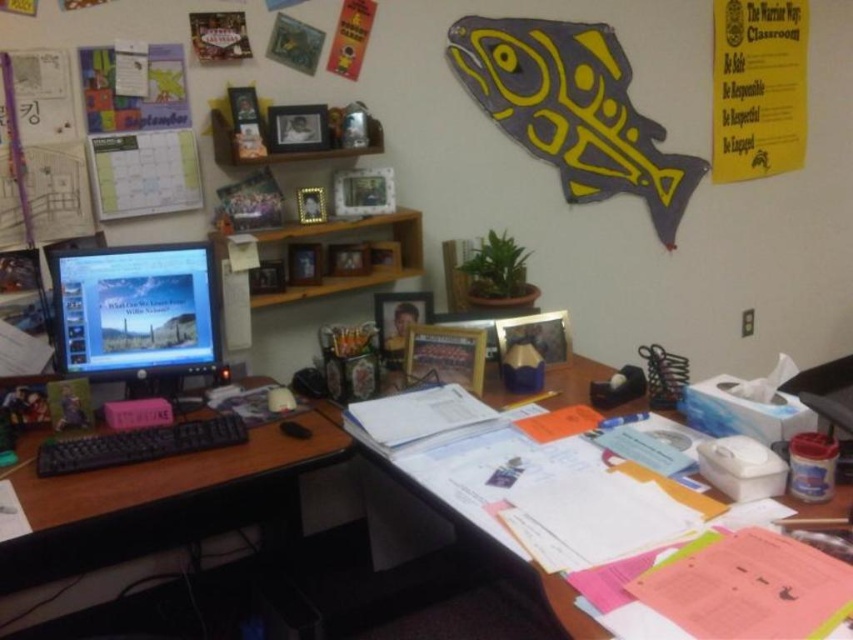
Looking at this image, what is the relationship between the width of the white paper at center and the black plastic keyboard at lower left?

The white paper at center is narrower than the black plastic keyboard at lower left.

You are a student who needs to reach for both the white paper at center and the black plastic keyboard at lower left. If your arm can only extend 30 inches, can you comfortably reach both items without moving your chair?

The white paper at center is 32.37 inches away from the black plastic keyboard at lower left. Since your arm can only extend 30 inches, you cannot comfortably reach both items without moving your chair.

Looking at this image, you are a student who needs to reach the black plastic keyboard at left to type a response. You are currently standing 5 feet away from the desk. Can you comfortably reach the keyboard without moving closer?

The black plastic keyboard at left is 6.13 feet away from the viewer, so since you are standing 5 feet away from the desk, you are closer than the required distance. Therefore, you can comfortably reach the keyboard without moving closer.